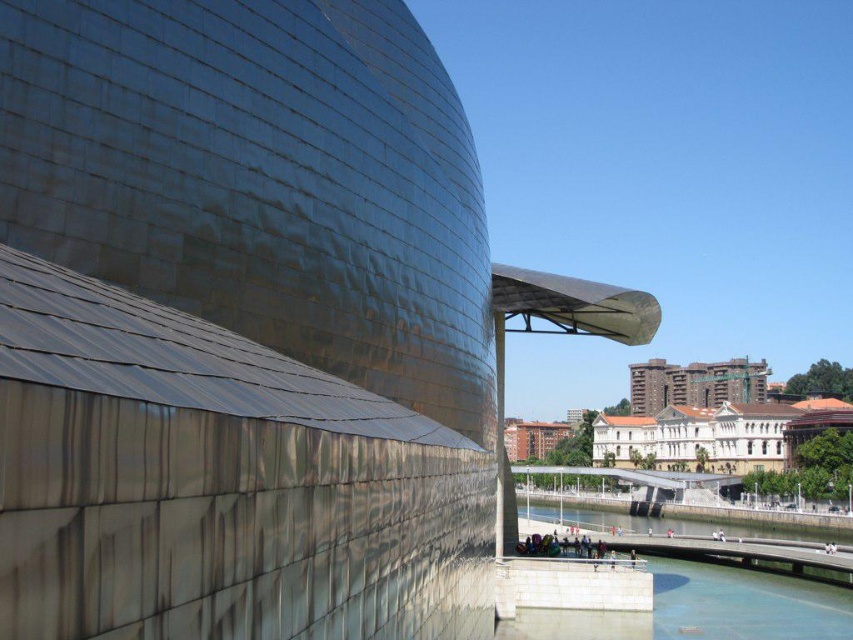
Between point (672, 593) and point (659, 518), which one is positioned in front?

Point (672, 593)

Who is positioned more to the left, clear glass water at lower center or clear water at lower center?

Positioned to the left is clear glass water at lower center.

Where is `clear glass water at lower center`? clear glass water at lower center is located at coordinates (701, 609).

Which is more to the left, clear glass water at lower center or dark brown brick building at center?

clear glass water at lower center is more to the left.

Measure the distance between clear glass water at lower center and camera.

63.59 meters

Measure the distance between point (821,637) and camera.

Point (821,637) and camera are 63.85 meters apart.

Identify the location of clear glass water at lower center. (701, 609).

Which is in front, point (703, 376) or point (848, 529)?

Positioned in front is point (848, 529).

Can you confirm if dark brown brick building at center is positioned to the left of clear water at lower center?

Answer: Incorrect, dark brown brick building at center is not on the left side of clear water at lower center.

Locate an element on the screen. dark brown brick building at center is located at coordinates (694, 384).

Locate an element on the screen. Image resolution: width=853 pixels, height=640 pixels. dark brown brick building at center is located at coordinates (694, 384).